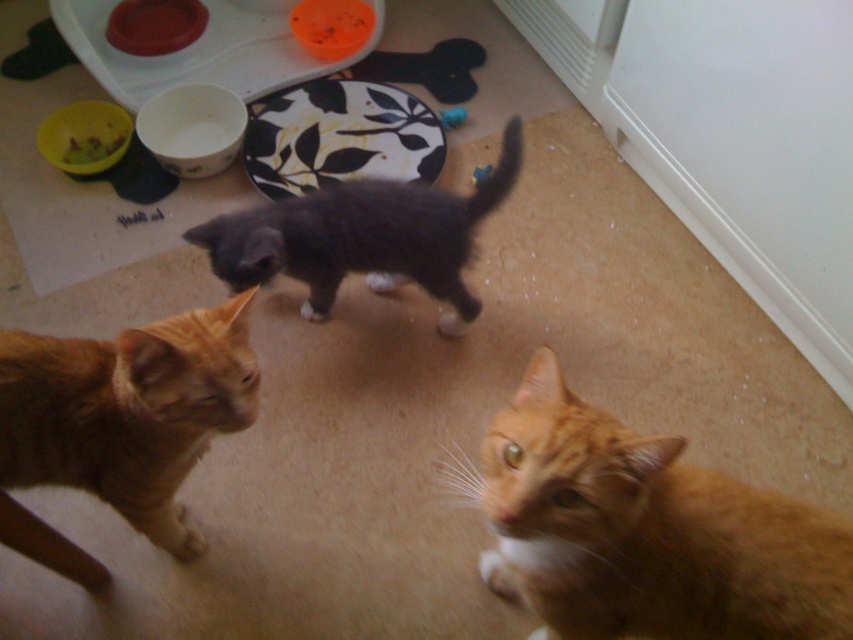
You are holding a 20 inch long toy and want to toss it to the orange fur cat at lower right. Can you reach the cat from your current position if you toss it straight ahead?

The orange fur cat at lower right is 31.17 inches from camera. Since the toy is only 20 inches long, you cannot reach the cat with a straight ahead toss.

You are a cat owner who wants to ensure your pets can reach their food and toys easily. Given the rubberized yellow bowl at upper left and the blue rubber toy at center, which item is taller and requires more effort for the cats to reach?

The rubberized yellow bowl at upper left is taller than the blue rubber toy at center, so it requires more effort for the cats to reach.

You are a cat owner who wants to place a new cat bed in the living room. The bed is 24 inches wide. You see the orange fur cat at lower right and the dark gray fur at center. Can you fit the cat bed between them without moving either cat?

The distance between the orange fur cat at lower right and the dark gray fur at center is 24.71 inches. Since the cat bed is 24 inches wide, there is enough space to fit it between them without moving either cat.